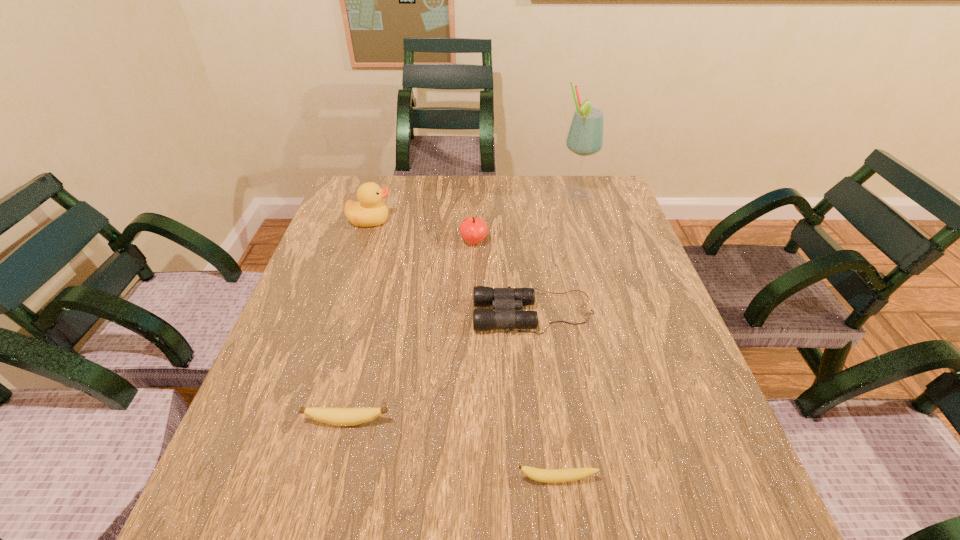
The image size is (960, 540). Find the location of `unoccupied position between the farther banana and the fourth tallest object`. unoccupied position between the farther banana and the fourth tallest object is located at coordinates (441, 367).

Identify the location of free space between the left banana and the farthest object. The image size is (960, 540). (461, 309).

Select which object appears as the third closest to the second nearest object. Please provide its 2D coordinates. Your answer should be formatted as a tuple, i.e. [(x, y)], where the tuple contains the x and y coordinates of a point satisfying the conditions above.

[(473, 229)]

This screenshot has width=960, height=540. In order to click on object identified as the third closest to the third farthest object in this screenshot , I will do `click(585, 137)`.

Identify the location of free space that satisfies the following two spatial constraints: 1. at the eyepiece of the fourth tallest object; 2. on the front side of the second nearest object. pos(547,422).